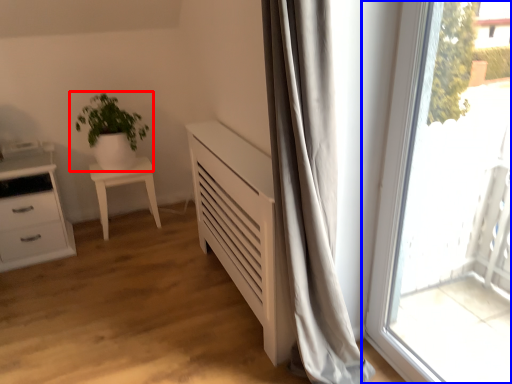
Question: Which point is further to the camera, houseplant (highlighted by a red box) or window (highlighted by a blue box)?

Choices:
 (A) houseplant
 (B) window

Answer: (A)